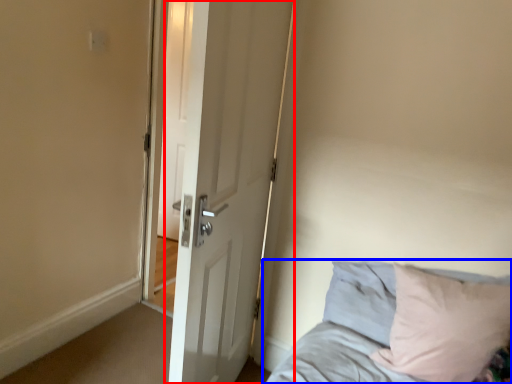
Question: Among these objects, which one is farthest to the camera, door (highlighted by a red box) or bed (highlighted by a blue box)?

Choices:
 (A) door
 (B) bed

Answer: (B)